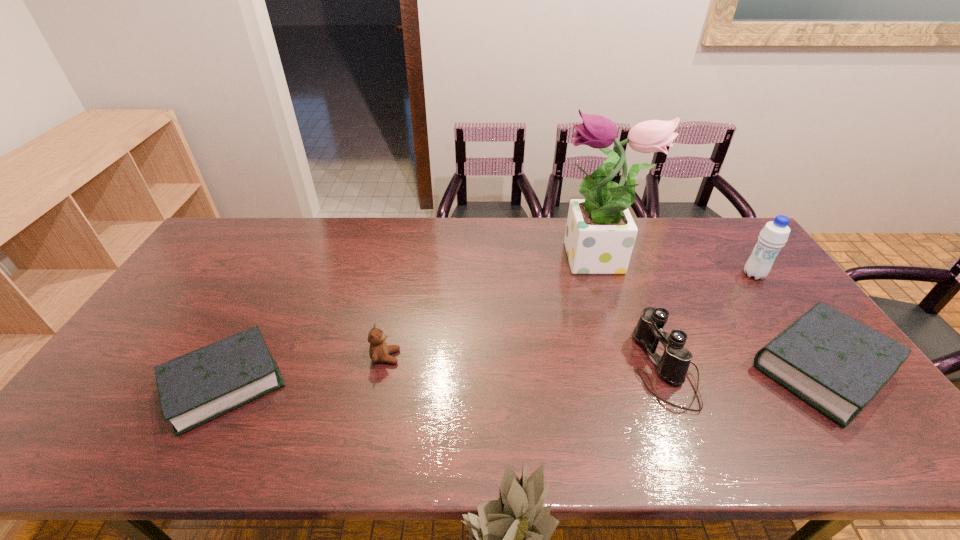
Locate an element on the screen. the left Bible is located at coordinates (199, 386).

Image resolution: width=960 pixels, height=540 pixels. Find the location of `the shortest object`. the shortest object is located at coordinates (199, 386).

Locate an element on the screen. Image resolution: width=960 pixels, height=540 pixels. the fifth tallest object is located at coordinates (837, 364).

You are a GUI agent. You are given a task and a screenshot of the screen. Output one action in this format:
    pyautogui.click(x=<x>, y=<y>)
    Task: Click on the taller Bible
    The height and width of the screenshot is (540, 960).
    Given the screenshot: What is the action you would take?
    pyautogui.click(x=837, y=364)

This screenshot has height=540, width=960. I want to click on the fifth shortest object, so click(774, 235).

This screenshot has height=540, width=960. Identify the location of the tallest object. (600, 234).

Where is `the fifth object from right to left`? The image size is (960, 540). the fifth object from right to left is located at coordinates (379, 351).

Where is `the third shortest object`? Image resolution: width=960 pixels, height=540 pixels. the third shortest object is located at coordinates pyautogui.click(x=379, y=351).

Find the location of a particular element. The width and height of the screenshot is (960, 540). binoculars is located at coordinates (673, 365).

This screenshot has width=960, height=540. I want to click on free space located on the back of the shortest object, so click(x=289, y=261).